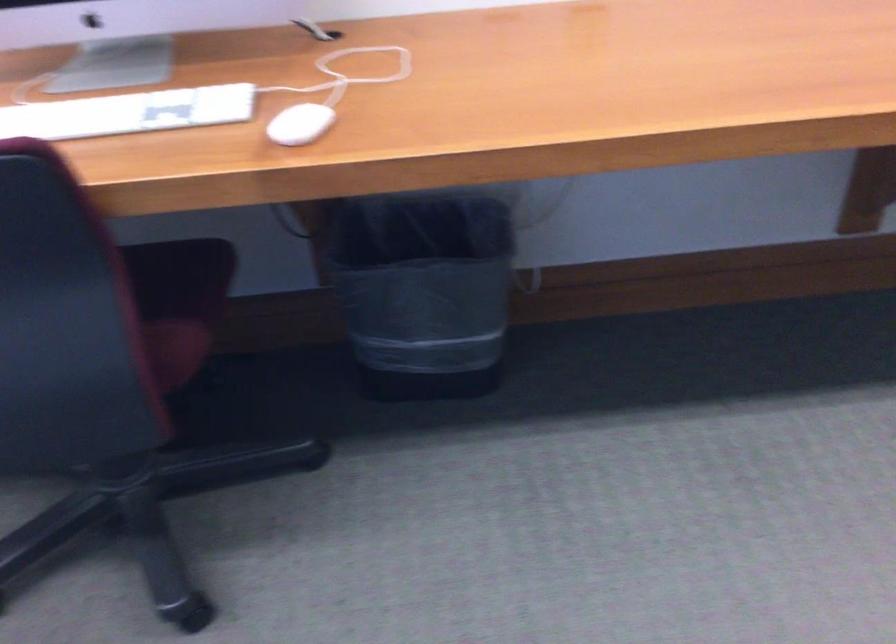
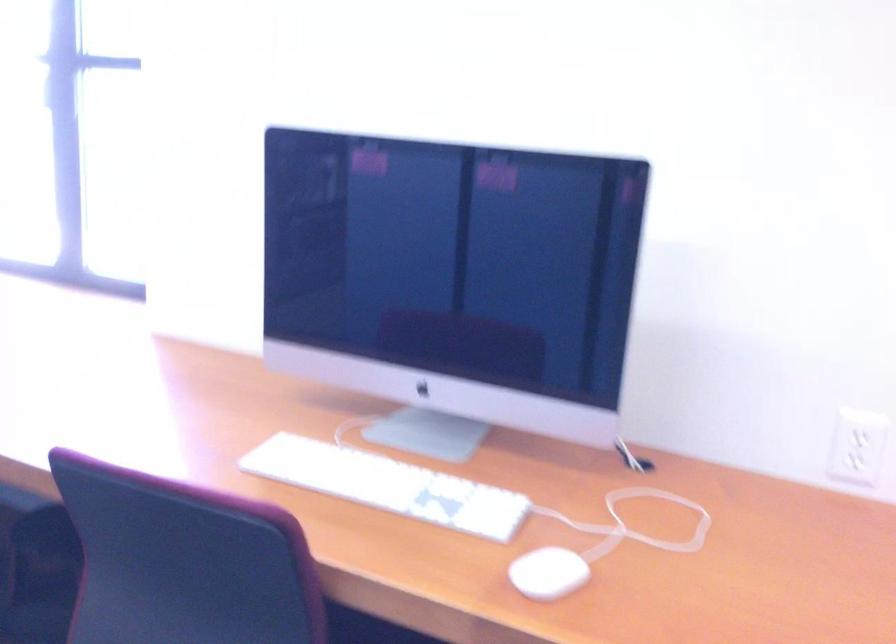
How did the camera likely rotate?

The rotation direction of the camera is left-up.